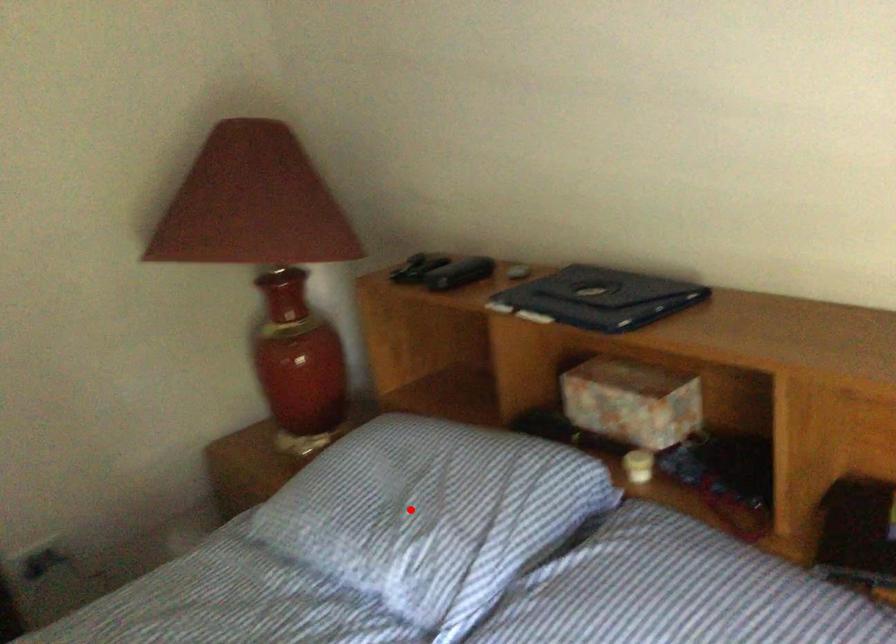
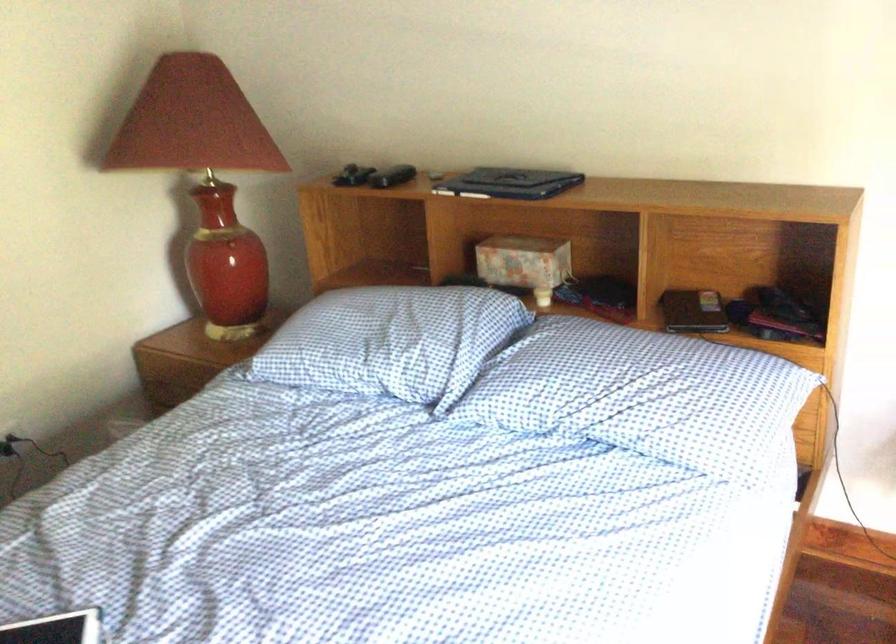
Question: I am providing you with two images of the same scene from different viewpoints. In image1, a red point is highlighted. Considering the same 3D point in image2, which of the following is correct?

Choices:
 (A) It is closer
 (B) It is farther

Answer: (B)